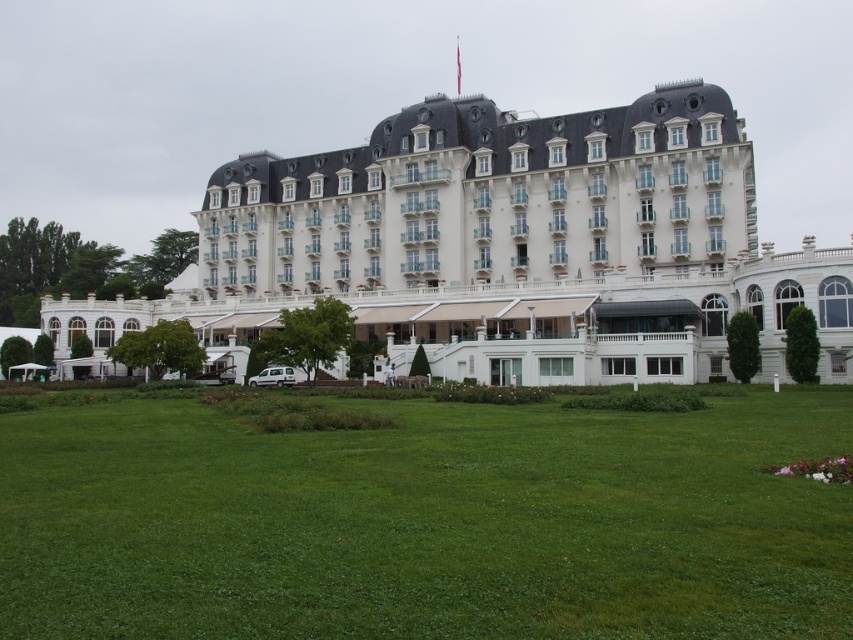
Question: Does green grass at lower center lie in front of white glossy building at center?

Choices:
 (A) no
 (B) yes

Answer: (B)

Question: Does green grass at lower center appear under white glossy building at center?

Choices:
 (A) yes
 (B) no

Answer: (A)

Question: Which of the following is the closest to the observer?

Choices:
 (A) (546, 147)
 (B) (10, 636)

Answer: (B)

Question: Can you confirm if green grass at lower center is bigger than white glossy building at center?

Choices:
 (A) no
 (B) yes

Answer: (A)

Question: Which point is farther from the camera taking this photo?

Choices:
 (A) (537, 429)
 (B) (258, 256)

Answer: (B)